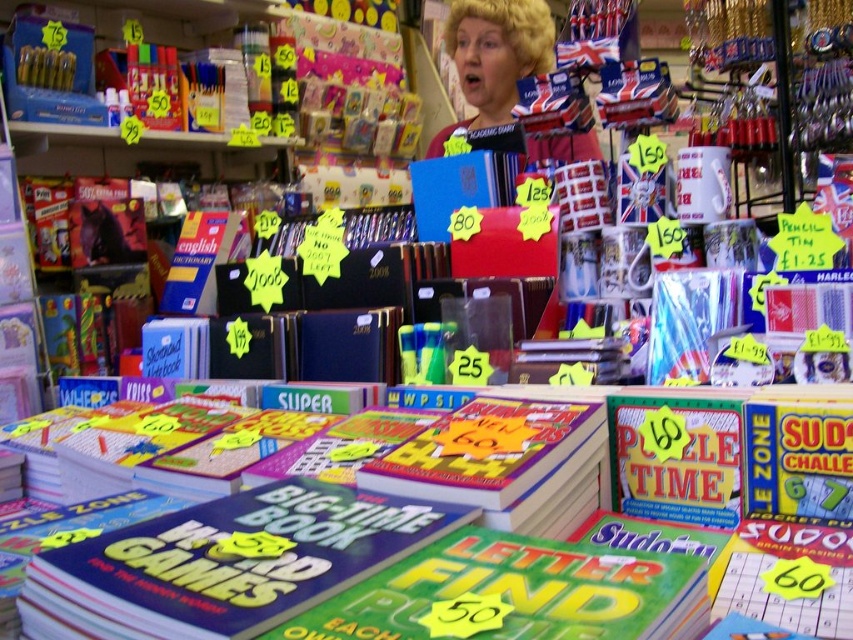
Does matte yellow book at center appear under blonde hair at upper center?

Correct, matte yellow book at center is located below blonde hair at upper center.

Measure the distance between matte yellow book at center and blonde hair at upper center.

matte yellow book at center is 6.73 feet away from blonde hair at upper center.

Which is behind, point (404, 545) or point (517, 70)?

The point (517, 70) is more distant.

Find the location of a particular element. The image size is (853, 640). matte yellow book at center is located at coordinates (225, 563).